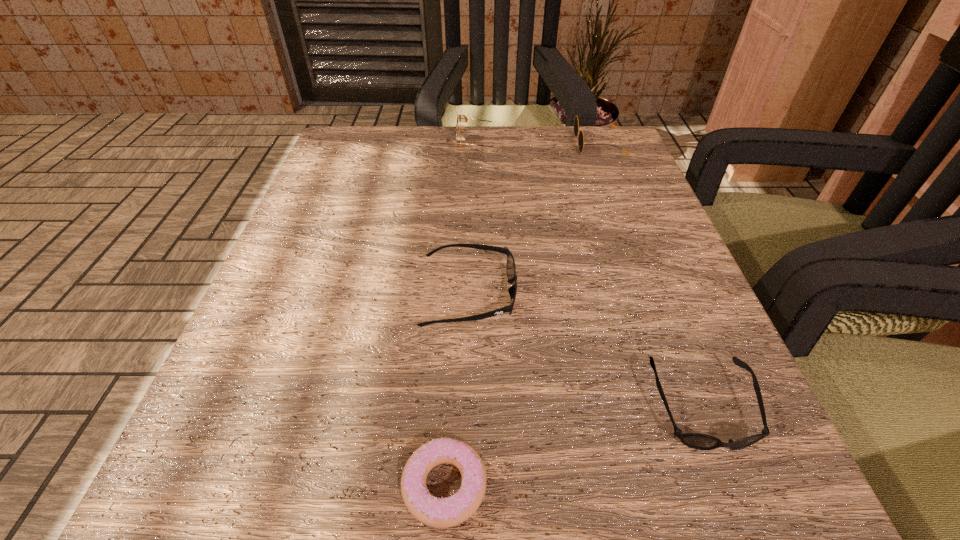
Where is `vacant region between the third nearest object and the nearest sunglasses`? vacant region between the third nearest object and the nearest sunglasses is located at coordinates (586, 350).

Find the location of a particular element. The height and width of the screenshot is (540, 960). free space between the third nearest object and the tallest sunglasses is located at coordinates (475, 220).

The width and height of the screenshot is (960, 540). Find the location of `vacant area that lies between the nearest sunglasses and the third nearest object`. vacant area that lies between the nearest sunglasses and the third nearest object is located at coordinates (586, 350).

The image size is (960, 540). In order to click on blank region between the doughnut and the third farthest object in this screenshot , I will do `click(457, 389)`.

At what (x,y) coordinates should I click in order to perform the action: click on free spot between the doughnut and the tallest sunglasses. Please return your answer as a coordinate pair (x, y). Image resolution: width=960 pixels, height=540 pixels. Looking at the image, I should click on (463, 315).

Image resolution: width=960 pixels, height=540 pixels. Identify the location of free area in between the nearest sunglasses and the doughnut. (573, 447).

This screenshot has height=540, width=960. In order to click on the third closest object to the nearest sunglasses in this screenshot , I will do `click(581, 144)`.

Where is `object that stands as the second closest to the tallest sunglasses`? The image size is (960, 540). object that stands as the second closest to the tallest sunglasses is located at coordinates (510, 267).

In order to click on sunglasses that stands as the third closest to the second nearest sunglasses in this screenshot , I will do `click(581, 144)`.

Find the location of a particular element. This screenshot has width=960, height=540. sunglasses that is the closest to the second nearest sunglasses is located at coordinates (697, 441).